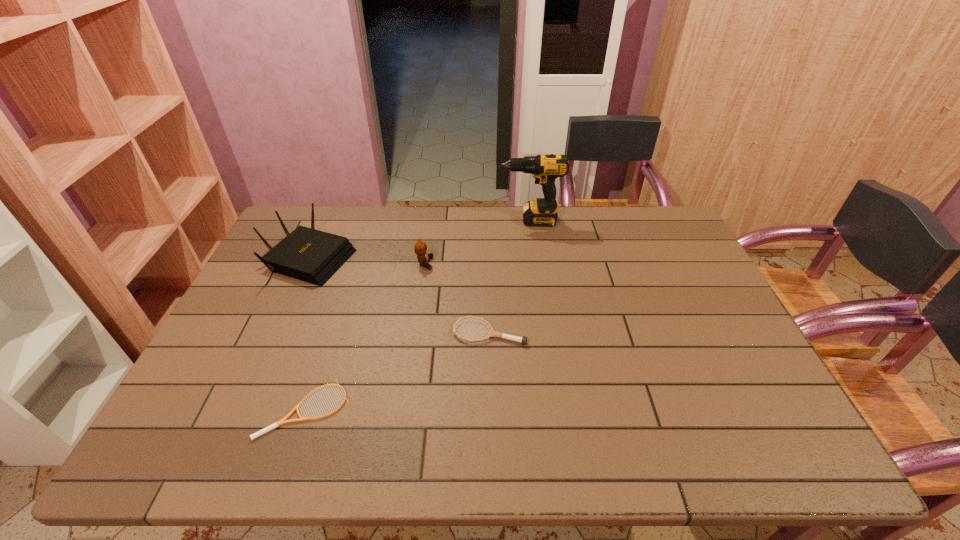
You are a GUI agent. You are given a task and a screenshot of the screen. Output one action in this format:
    pyautogui.click(x=<x>, y=<y>)
    Task: Click on the vacant area that lies between the nearest object and the third shortest object
    The image size is (960, 540).
    Given the screenshot: What is the action you would take?
    [x=365, y=336]

Identify the location of free area in between the shorter tennis racket and the third tallest object. (365, 336).

Identify the location of free area in between the teddy bear and the taller tennis racket. (457, 298).

Where is `empty space between the taller tennis racket and the drill`? The image size is (960, 540). empty space between the taller tennis racket and the drill is located at coordinates (510, 276).

The width and height of the screenshot is (960, 540). In order to click on vacant region between the taller tennis racket and the farthest object in this screenshot , I will do `click(510, 276)`.

Identify which object is the second closest to the fourth shortest object. Please provide its 2D coordinates. Your answer should be formatted as a tuple, i.e. [(x, y)], where the tuple contains the x and y coordinates of a point satisfying the conditions above.

[(283, 421)]

Select which object is the fourth closest to the nearest object. Please provide its 2D coordinates. Your answer should be formatted as a tuple, i.e. [(x, y)], where the tuple contains the x and y coordinates of a point satisfying the conditions above.

[(545, 168)]

This screenshot has width=960, height=540. Identify the location of free location that satisfies the following two spatial constraints: 1. on the front-facing side of the third shortest object; 2. on the left side of the fourth farthest object. (415, 332).